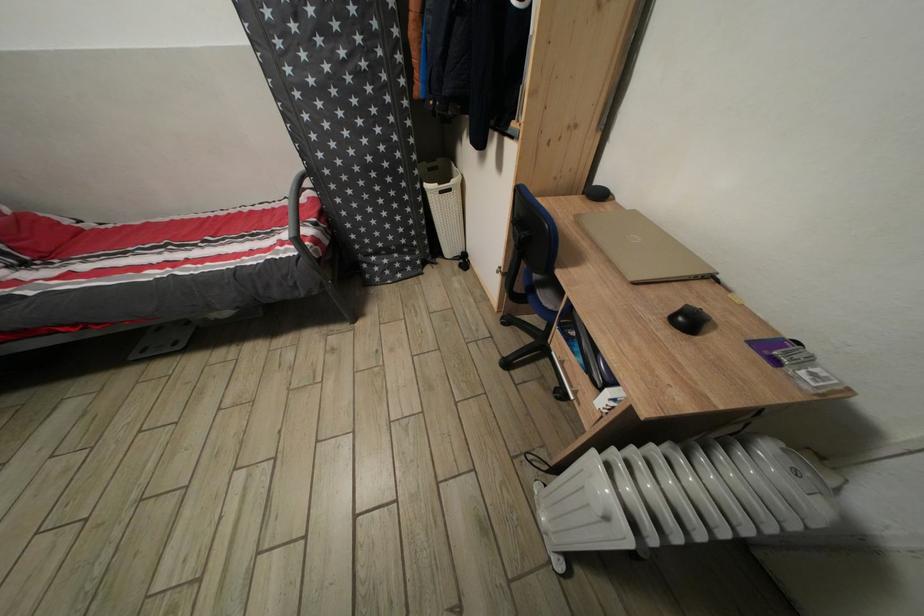
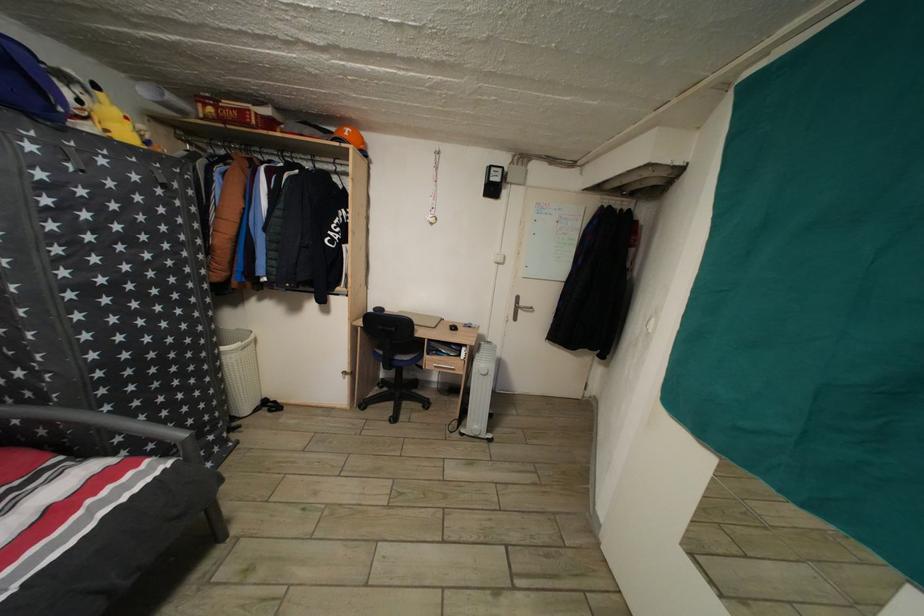
The point at (432,192) is marked in the first image. Where is the corresponding point in the second image?

(229, 355)